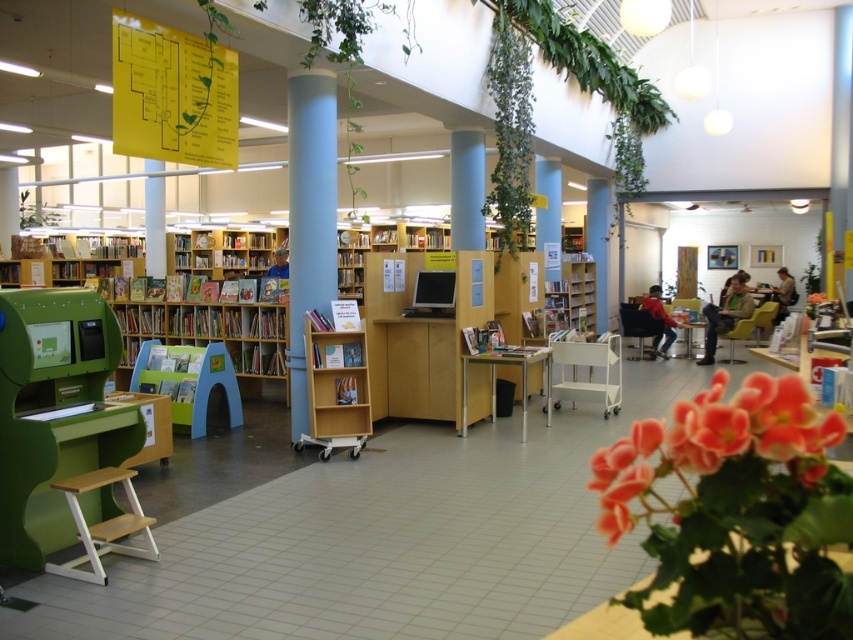
Question: Is light brown wooden stool at lower left further to the viewer compared to matte black monitor at center?

Choices:
 (A) yes
 (B) no

Answer: (B)

Question: Where is yellow paper map at upper left located in relation to green matte plant at upper left in the image?

Choices:
 (A) right
 (B) left

Answer: (A)

Question: Is green leafy plant at upper center smaller than matte black monitor at center?

Choices:
 (A) yes
 (B) no

Answer: (B)

Question: Which of the following is the farthest from the observer?

Choices:
 (A) (763, 401)
 (B) (619, 346)
 (C) (763, 324)

Answer: (B)

Question: Which point is closer to the camera?

Choices:
 (A) green leafy plant at upper center
 (B) wooden bookshelf at center

Answer: (A)

Question: Among these points, which one is farthest from the camera?

Choices:
 (A) (573, 388)
 (B) (589, 218)
 (C) (517, 35)

Answer: (B)